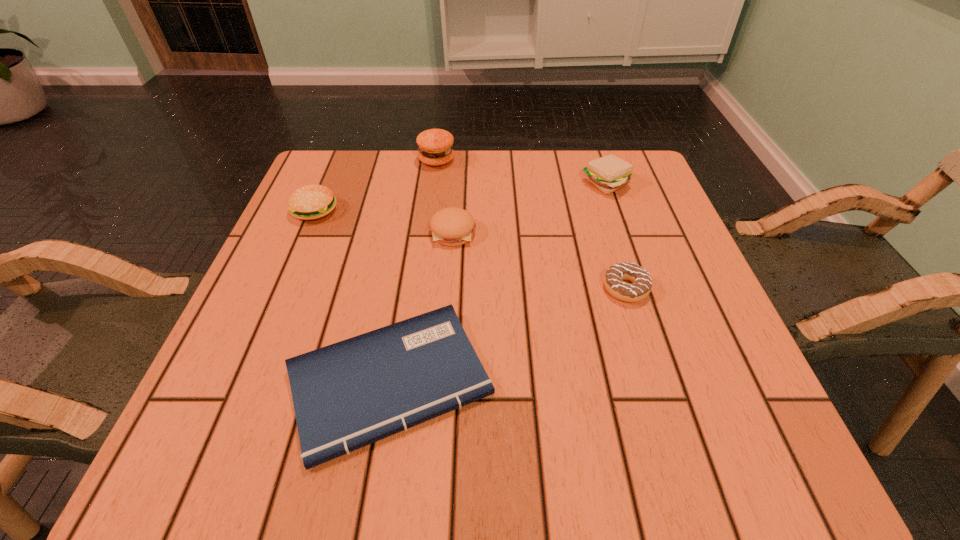
This screenshot has width=960, height=540. I want to click on vacant space located on the front of the leftmost patty, so click(244, 379).

At what (x,y) coordinates should I click in order to perform the action: click on vacant space located 0.270m on the front of the fifth farthest object. Please return your answer as a coordinate pair (x, y). This screenshot has width=960, height=540. Looking at the image, I should click on point(676,449).

Find the location of `vacant region located 0.190m on the right of the paperback book`. vacant region located 0.190m on the right of the paperback book is located at coordinates (612, 381).

Identify the location of object situated at the near edge. [x=347, y=395].

Image resolution: width=960 pixels, height=540 pixels. What are the coordinates of `patty that is at the left edge` in the screenshot? It's located at (309, 202).

Where is `paperback book situated at the left edge`? paperback book situated at the left edge is located at coordinates (347, 395).

What are the coordinates of `patty positioned at the right edge` in the screenshot? It's located at (609, 173).

The image size is (960, 540). Find the location of `doughnut positioned at the right edge`. doughnut positioned at the right edge is located at coordinates (641, 285).

Identify the location of object located at the far left corner. (309, 202).

Identify the location of object present at the near left corner. The height and width of the screenshot is (540, 960). (347, 395).